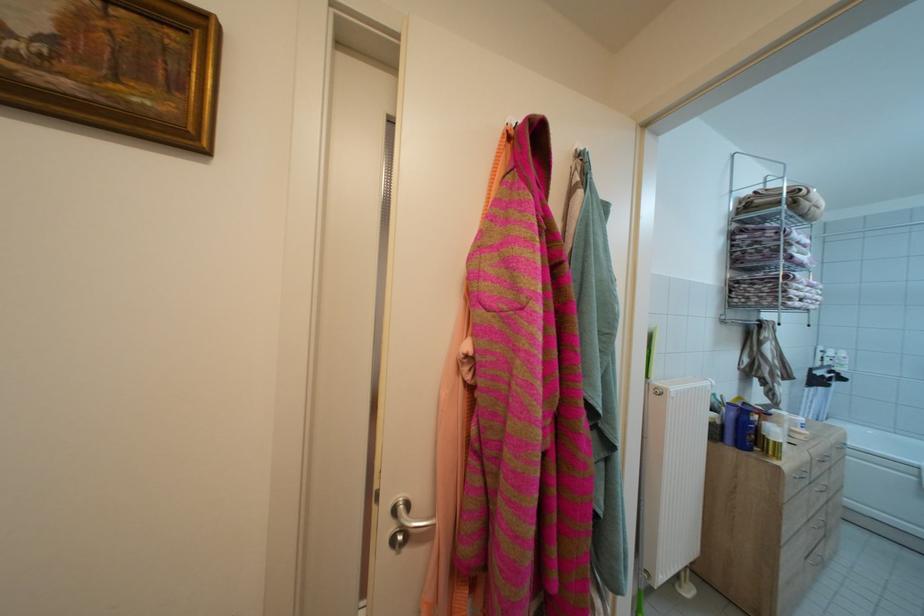
You are a GUI agent. You are given a task and a screenshot of the screen. Output one action in this format:
    pyautogui.click(x=<x>, y=<y>)
    Task: Click on the silver door handle
    Image resolution: width=924 pixels, height=616 pixels.
    Given the screenshot: What is the action you would take?
    pyautogui.click(x=408, y=517)